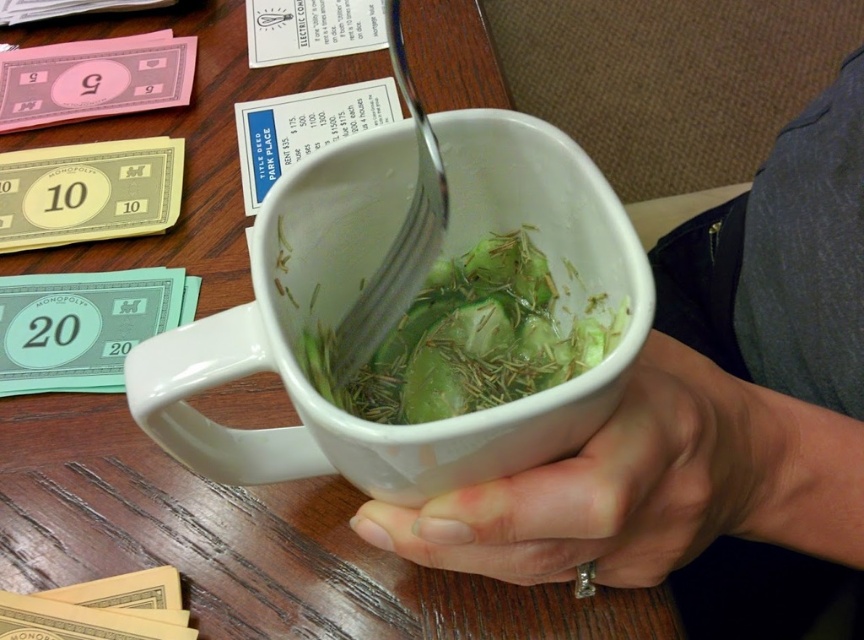
Question: Among these points, which one is nearest to the camera?

Choices:
 (A) (108, 291)
 (B) (86, 230)
 (C) (812, 301)

Answer: (C)

Question: Is white matte cup at center below smooth white mug at center?

Choices:
 (A) no
 (B) yes

Answer: (A)

Question: Is the position of green paper money at left less distant than that of satin silver fork at center?

Choices:
 (A) yes
 (B) no

Answer: (B)

Question: Among these points, which one is nearest to the camera?

Choices:
 (A) (56, 237)
 (B) (481, 435)
 (C) (472, 324)
 (D) (122, 611)

Answer: (B)

Question: Which of the following is the farthest from the observer?

Choices:
 (A) (45, 280)
 (B) (30, 605)
 (C) (710, 480)
 (D) (522, 316)

Answer: (A)

Question: Is green leafy vegetable at center to the left of green paper money at left from the viewer's perspective?

Choices:
 (A) yes
 (B) no

Answer: (B)